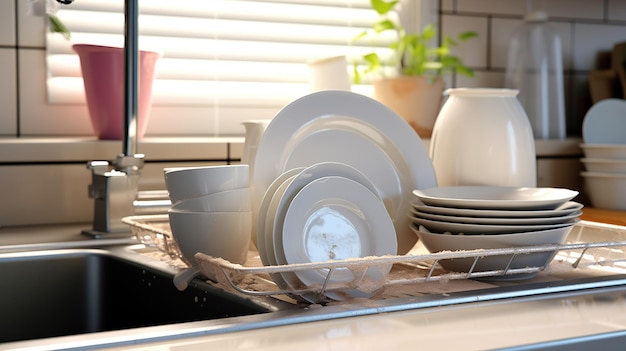
This screenshot has height=351, width=626. Identify the location of backsplash tiles. (24, 110), (8, 84), (9, 25), (22, 23), (496, 3), (464, 37), (505, 28), (490, 77), (592, 31), (613, 12).